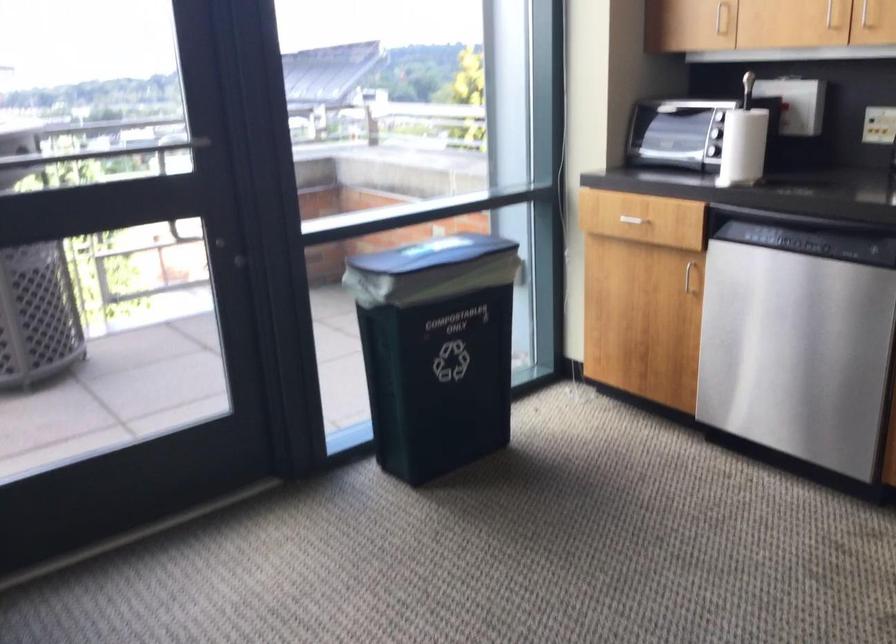
You are a GUI agent. You are given a task and a screenshot of the screen. Output one action in this format:
    pyautogui.click(x=<x>, y=<y>)
    Task: Click on the silver holder top
    The height and width of the screenshot is (644, 896).
    Given the screenshot: What is the action you would take?
    click(691, 105)